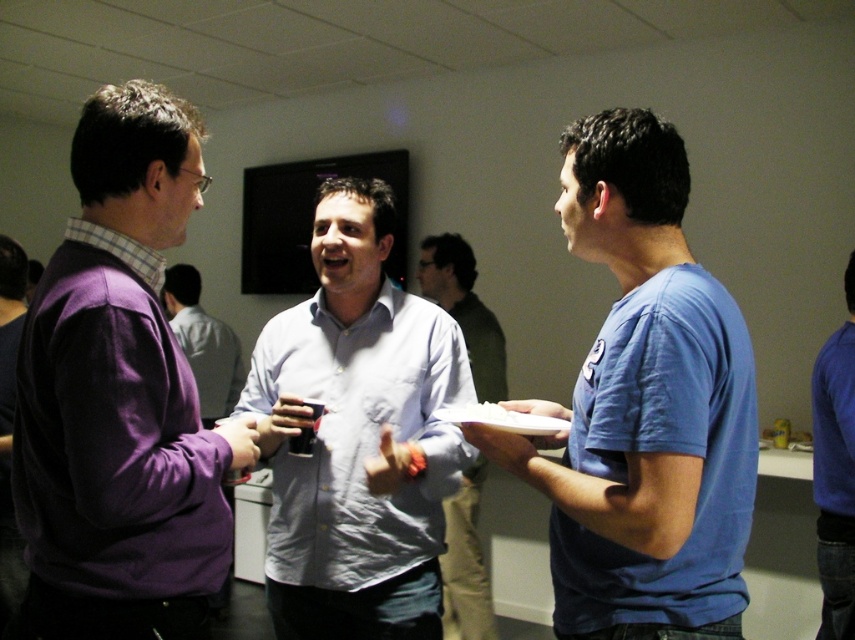
Between light blue shirt at center and blue cotton shirt at right, which one is positioned higher?

light blue shirt at center is higher up.

Consider the image. Between light blue shirt at center and blue cotton shirt at right, which one is positioned lower?

blue cotton shirt at right is below.

Does point (476, 516) come farther from viewer compared to point (850, 508)?

Yes, it is.

Identify the location of light blue shirt at center. (464, 308).

Does purple matte sweater at left have a greater width compared to light blue cotton shirt at center?

No.

Can you confirm if purple matte sweater at left is shorter than light blue cotton shirt at center?

In fact, purple matte sweater at left may be taller than light blue cotton shirt at center.

You are a GUI agent. You are given a task and a screenshot of the screen. Output one action in this format:
    pyautogui.click(x=<x>, y=<y>)
    Task: Click on the purple matte sweater at left
    The height and width of the screenshot is (640, 855).
    Given the screenshot: What is the action you would take?
    pyautogui.click(x=121, y=397)

Does blue cotton t-shirt at right come in front of light blue cotton shirt at center?

Yes, it is.

Does blue cotton t-shirt at right have a lesser width compared to light blue cotton shirt at center?

Indeed, blue cotton t-shirt at right has a lesser width compared to light blue cotton shirt at center.

Does point (572, 406) lie behind point (319, 426)?

No, it is not.

You are a GUI agent. You are given a task and a screenshot of the screen. Output one action in this format:
    pyautogui.click(x=<x>, y=<y>)
    Task: Click on the blue cotton t-shirt at right
    The width and height of the screenshot is (855, 640).
    Given the screenshot: What is the action you would take?
    pyautogui.click(x=644, y=406)